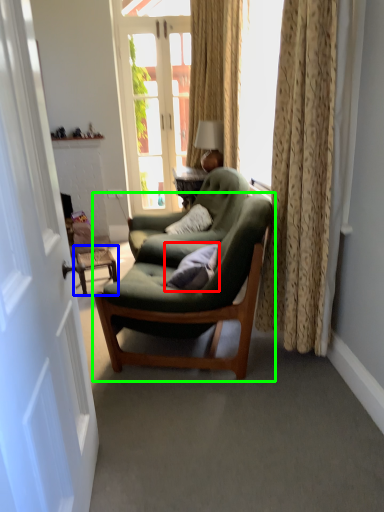
Question: Which object is the farthest from pillow (highlighted by a red box)? Choose among these: side table (highlighted by a blue box) or chair (highlighted by a green box).

Choices:
 (A) side table
 (B) chair

Answer: (A)